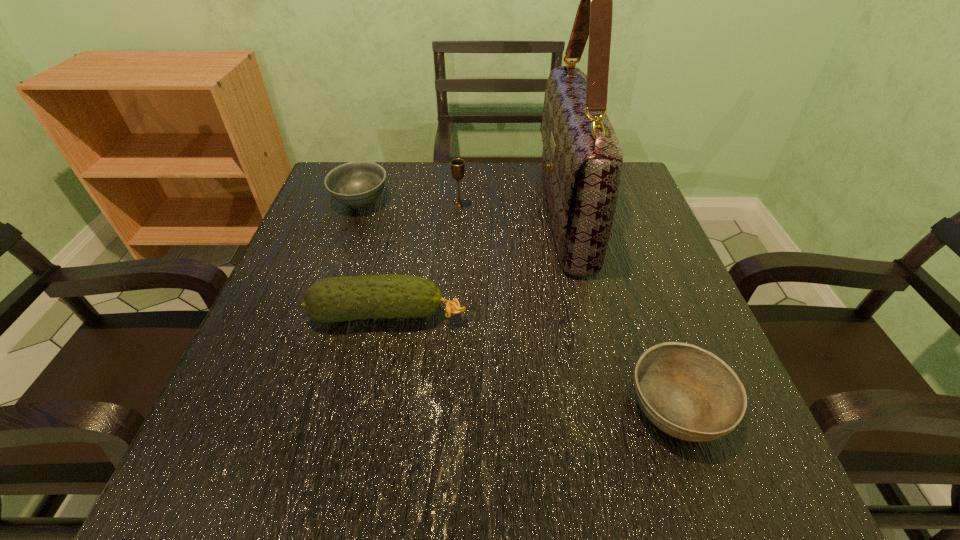
The width and height of the screenshot is (960, 540). In order to click on handbag in this screenshot , I will do `click(582, 159)`.

You are a GUI agent. You are given a task and a screenshot of the screen. Output one action in this format:
    pyautogui.click(x=<x>, y=<y>)
    Task: Click on the chalice
    
    Given the screenshot: What is the action you would take?
    (457, 165)

Where is `the third tallest object`? This screenshot has width=960, height=540. the third tallest object is located at coordinates (346, 298).

You are a GUI agent. You are given a task and a screenshot of the screen. Output one action in this format:
    pyautogui.click(x=<x>, y=<y>)
    Task: Click on the cucumber
    The image size is (960, 540).
    Given the screenshot: What is the action you would take?
    pyautogui.click(x=346, y=298)

The height and width of the screenshot is (540, 960). Identify the location of the left bowl. (359, 183).

You are a GUI agent. You are given a task and a screenshot of the screen. Output one action in this format:
    pyautogui.click(x=<x>, y=<y>)
    Task: Click on the right bowl
    This screenshot has width=960, height=540.
    Given the screenshot: What is the action you would take?
    pyautogui.click(x=689, y=393)

Find the location of a particular element. Image resolution: width=960 pixels, height=540 pixels. the nearest object is located at coordinates [689, 393].

Where is `vacant space located 0.080m on the front of the tallest object with the clasp`? The height and width of the screenshot is (540, 960). vacant space located 0.080m on the front of the tallest object with the clasp is located at coordinates point(508,214).

This screenshot has height=540, width=960. Identify the location of free space located on the front of the tallest object with the clasp. (420, 214).

Locate an element on the screen. The width and height of the screenshot is (960, 540). vacant area situated 0.290m on the front of the tallest object with the clasp is located at coordinates (420, 214).